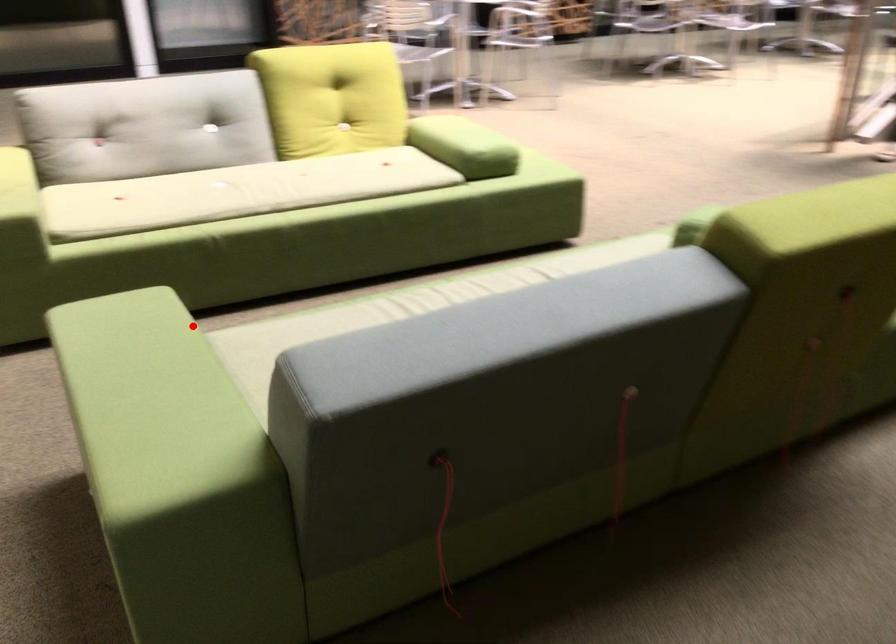
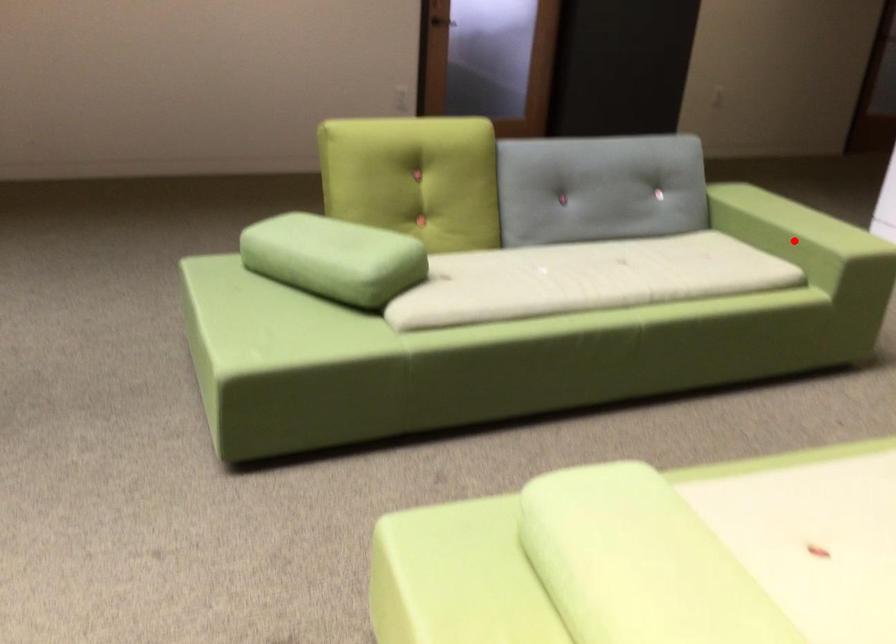
I am providing you with two images of the same scene from different viewpoints. A red point is marked on the first image and another point is marked on the second image. Do the highlighted points in image1 and image2 indicate the same real-world spot?

Yes